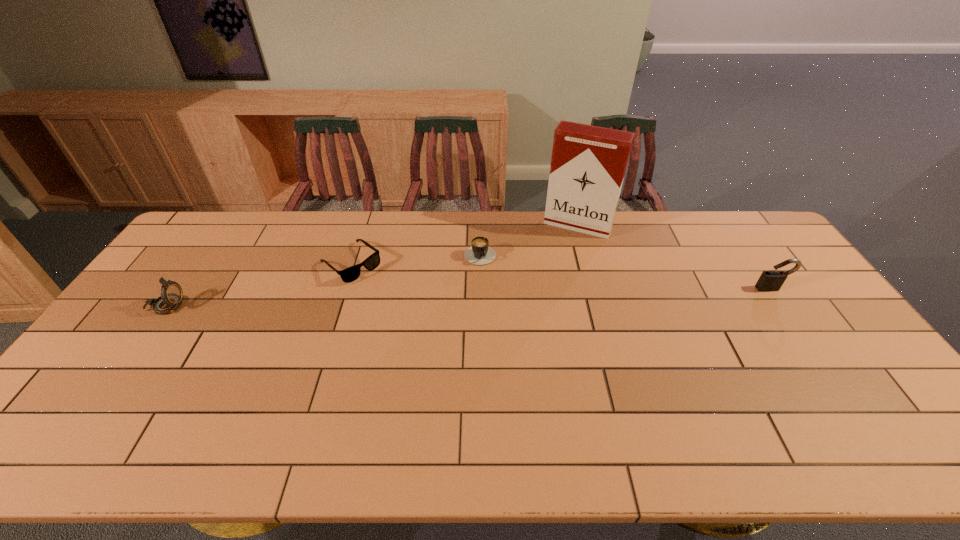
At what (x,y) coordinates should I click in order to perform the action: click on cappuccino present at the far edge. Please return your answer as a coordinate pair (x, y). The height and width of the screenshot is (540, 960). Looking at the image, I should click on (480, 253).

Locate an element on the screen. object positioned at the left edge is located at coordinates (171, 292).

Where is `object that is at the right edge`? This screenshot has width=960, height=540. object that is at the right edge is located at coordinates (771, 280).

At what (x,y) coordinates should I click in order to perform the action: click on vacant area at the far edge of the desktop. Please return your answer as a coordinate pair (x, y). This screenshot has width=960, height=540. Looking at the image, I should click on (249, 221).

In order to click on vacant space at the near edge of the desktop in this screenshot , I will do `click(150, 393)`.

The image size is (960, 540). In the image, there is a desktop. In order to click on free region at the left edge in this screenshot , I will do `click(218, 254)`.

Where is `blank space at the far left corner`? The height and width of the screenshot is (540, 960). blank space at the far left corner is located at coordinates (211, 249).

At what (x,y) coordinates should I click in order to perform the action: click on vacant space at the near left corner. Please return your answer as a coordinate pair (x, y). Looking at the image, I should click on (82, 417).

Locate an element on the screen. vacant position at the far right corner of the desktop is located at coordinates (748, 224).

At what (x,y) coordinates should I click in order to perform the action: click on free spot between the nearest object and the fourth object from right to left. Please return your answer as a coordinate pair (x, y). The image size is (960, 540). Looking at the image, I should click on (257, 285).